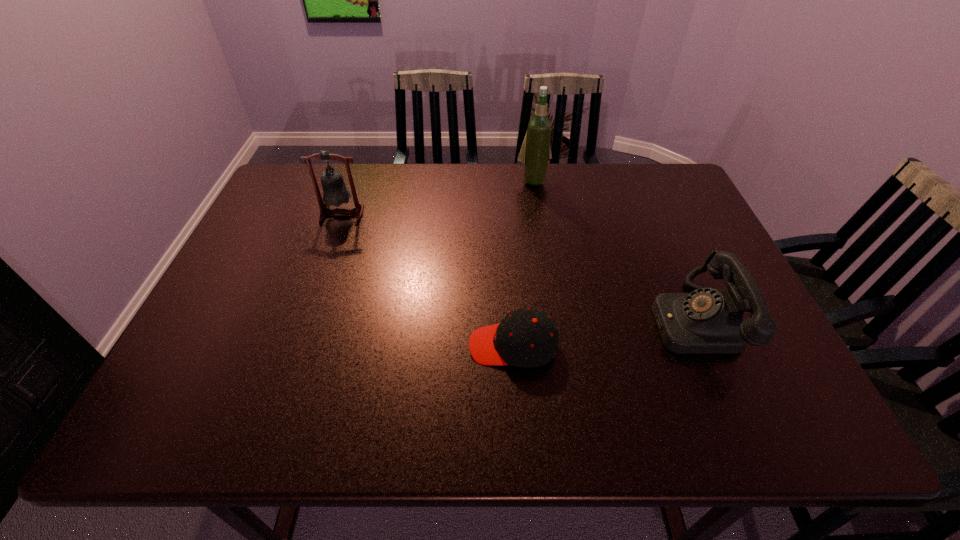
Locate an element on the screen. The width and height of the screenshot is (960, 540). free area in between the cap and the third tallest object is located at coordinates (603, 333).

The image size is (960, 540). In order to click on free spot between the cap and the second tallest object in this screenshot , I will do `click(427, 280)`.

This screenshot has height=540, width=960. What are the coordinates of `the third closest object to the wine bottle` in the screenshot? It's located at (527, 338).

You are a GUI agent. You are given a task and a screenshot of the screen. Output one action in this format:
    pyautogui.click(x=<x>, y=<y>)
    Task: Click on the third closest object to the farthest object
    This screenshot has width=960, height=540.
    Given the screenshot: What is the action you would take?
    pyautogui.click(x=527, y=338)